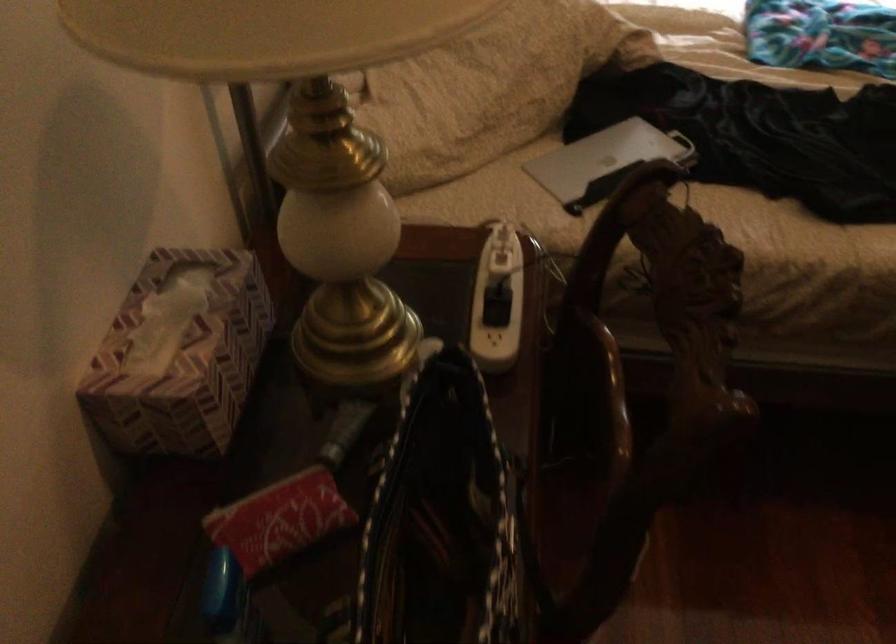
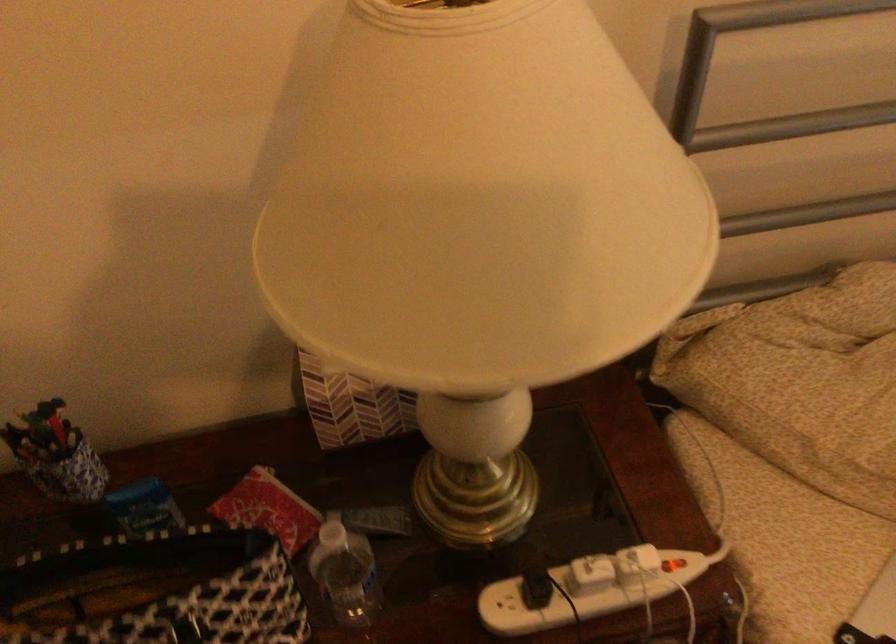
Based on the continuous images, in which direction is the camera rotating?

The camera's rotation is toward left-down.